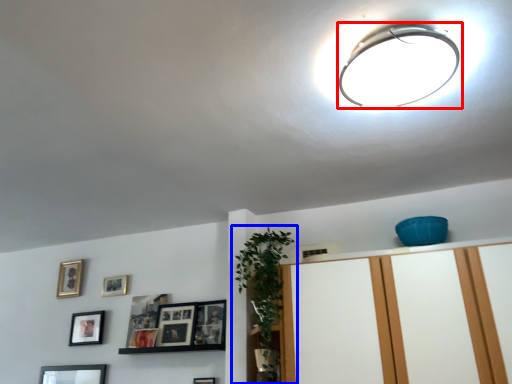
Question: Which object appears farthest to the camera in this image, lamp (highlighted by a red box) or houseplant (highlighted by a blue box)?

Choices:
 (A) lamp
 (B) houseplant

Answer: (B)